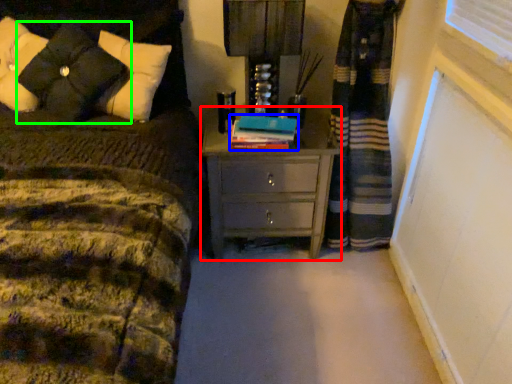
Question: Considering the real-world distances, which object is closest to chest of drawers (highlighted by a red box)? book (highlighted by a blue box) or pillow (highlighted by a green box).

Choices:
 (A) book
 (B) pillow

Answer: (A)